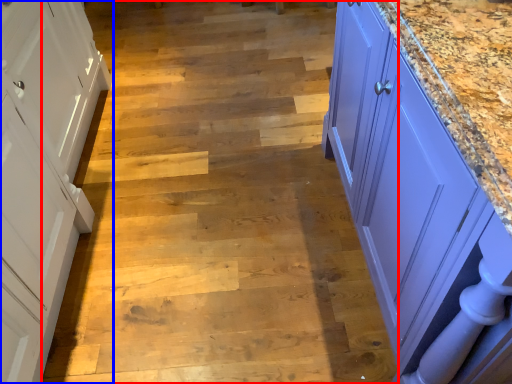
Question: Among these objects, which one is nearest to the camera, stair (highlighted by a red box) or cabinetry (highlighted by a blue box)?

Choices:
 (A) stair
 (B) cabinetry

Answer: (B)